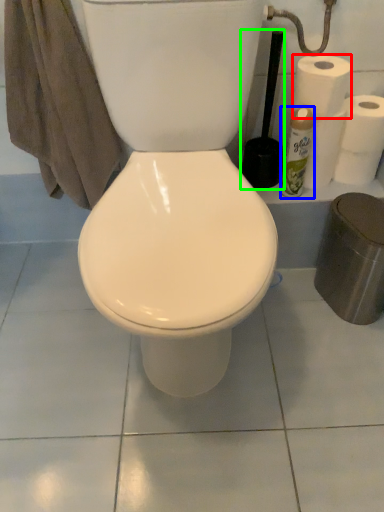
Question: Which object is the closest to the paper towel (highlighted by a red box)? Choose among these: cleaning product (highlighted by a blue box) or brush (highlighted by a green box).

Choices:
 (A) cleaning product
 (B) brush

Answer: (A)